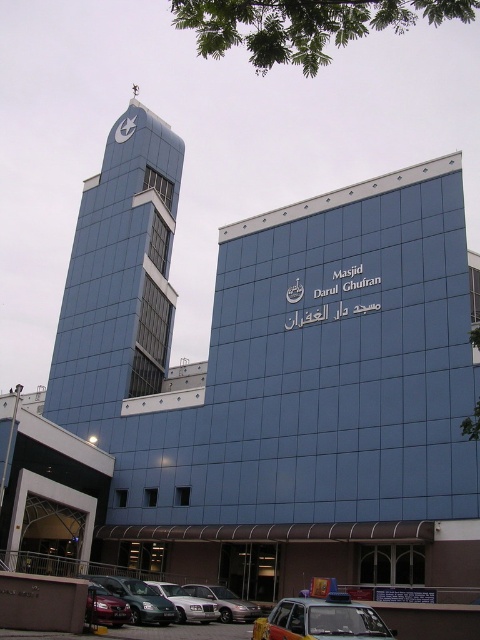
Question: Which object appears farthest from the camera in this image?

Choices:
 (A) silver metallic sedan at center
 (B) blue glass bell tower at upper left

Answer: (B)

Question: Which point appears closest to the camera in this image?

Choices:
 (A) (x=133, y=124)
 (B) (x=255, y=621)
 (C) (x=190, y=600)

Answer: (B)

Question: Does silver metallic sedan at center have a smaller size compared to metallic clock at upper center?

Choices:
 (A) yes
 (B) no

Answer: (B)

Question: Is blue glass bell tower at upper left to the right of metallic green car at lower left from the viewer's perspective?

Choices:
 (A) no
 (B) yes

Answer: (A)

Question: Which is nearer to the metallic green car at lower left?

Choices:
 (A) silver metallic sedan at center
 (B) silver metallic sedan at lower center
 (C) metallic taxi cab at lower center
 (D) shiny metallic car at lower left

Answer: (A)

Question: Is shiny metallic car at lower left below metallic clock at upper center?

Choices:
 (A) no
 (B) yes

Answer: (B)